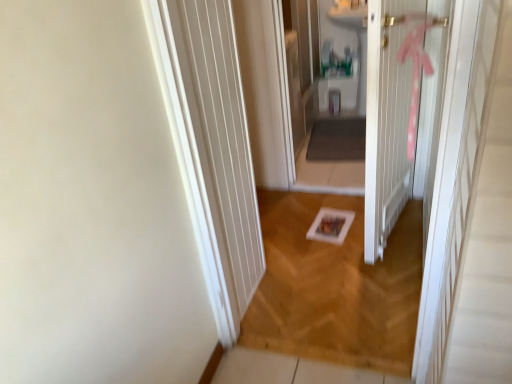
Question: Is wooden frame at center inside or outside of white wooden door at center?

Choices:
 (A) inside
 (B) outside

Answer: (B)

Question: Looking at their shapes, would you say wooden frame at center is wider or thinner than white wooden door at center?

Choices:
 (A) wide
 (B) thin

Answer: (A)

Question: Which of these objects is positioned farthest from the matte white sink at center?

Choices:
 (A) white wooden door at center
 (B) wooden frame at center

Answer: (B)

Question: Which object is the farthest from the white wooden door at center?

Choices:
 (A) wooden frame at center
 (B) matte white sink at center

Answer: (B)